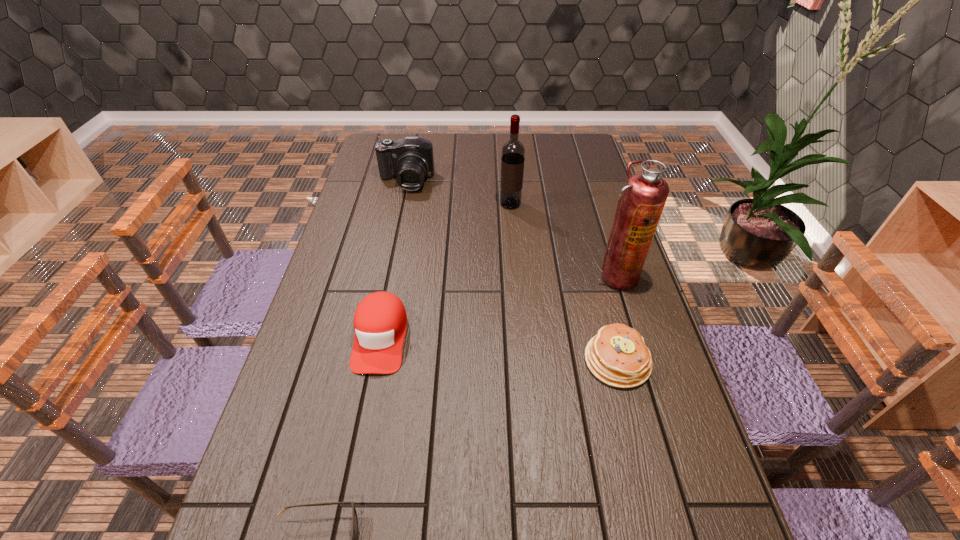
Where is `free space between the third shortest object and the farthest object`? This screenshot has width=960, height=540. free space between the third shortest object and the farthest object is located at coordinates (394, 259).

The width and height of the screenshot is (960, 540). In order to click on empty space between the pancake and the baseball cap in this screenshot , I will do `click(499, 349)`.

The width and height of the screenshot is (960, 540). I want to click on empty space between the fire extinguisher and the third tallest object, so click(x=511, y=230).

What are the coordinates of `free space between the fourth tallest object and the second farthest object` in the screenshot? It's located at (445, 271).

The image size is (960, 540). I want to click on vacant region between the fifth tallest object and the third farthest object, so click(616, 319).

The height and width of the screenshot is (540, 960). What are the coordinates of `free space between the fourth nearest object and the baseball cap` in the screenshot? It's located at (498, 307).

Find the location of a particular element. free spot between the fire extinguisher and the third object from right to left is located at coordinates (564, 240).

I want to click on unoccupied area between the fire extinguisher and the fifth shortest object, so click(x=564, y=240).

This screenshot has width=960, height=540. In order to click on the second closest object relative to the fourth tallest object in this screenshot , I will do `click(617, 355)`.

Find the location of a particular element. This screenshot has width=960, height=540. object that stands as the second closest to the nearest object is located at coordinates (617, 355).